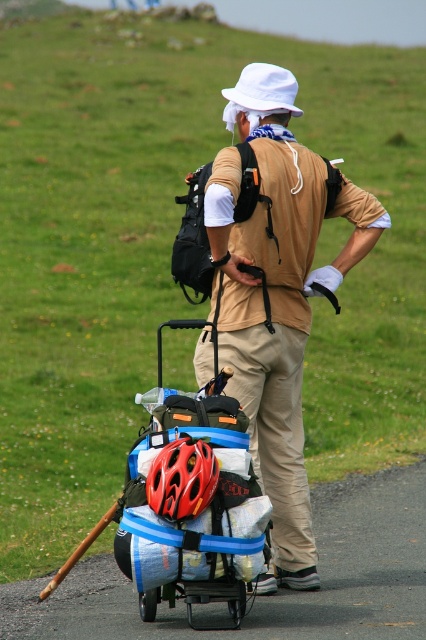
Who is positioned more to the left, matte black wagon at center or shiny red helmet at center?

shiny red helmet at center

Does matte black wagon at center appear on the right side of shiny red helmet at center?

Indeed, matte black wagon at center is positioned on the right side of shiny red helmet at center.

Does point (238, 589) come in front of point (164, 486)?

No.

You are a GUI agent. You are given a task and a screenshot of the screen. Output one action in this format:
    pyautogui.click(x=<x>, y=<y>)
    Task: Click on the matte black wagon at center
    This screenshot has width=426, height=640.
    Given the screenshot: What is the action you would take?
    pyautogui.click(x=192, y=500)

Consider the image. Does matte black wagon at center have a larger size compared to khaki pants at center?

Indeed, matte black wagon at center has a larger size compared to khaki pants at center.

Can you confirm if matte black wagon at center is positioned to the left of khaki pants at center?

Indeed, matte black wagon at center is positioned on the left side of khaki pants at center.

Is point (233, 476) closer to camera compared to point (270, 390)?

Yes, it is in front of point (270, 390).

Locate an element on the screen. The width and height of the screenshot is (426, 640). matte black wagon at center is located at coordinates (192, 500).

Looking at this image, is tan fabric backpack at center below matte black wagon at center?

No, tan fabric backpack at center is not below matte black wagon at center.

Does point (290, 548) come closer to viewer compared to point (155, 387)?

Yes, it is.

Is point (213, 240) positioned behind point (149, 552)?

Yes.

You are a GUI agent. You are given a task and a screenshot of the screen. Output one action in this format:
    pyautogui.click(x=<x>, y=<y>)
    Task: Click on the tan fabric backpack at center
    This screenshot has width=426, height=640.
    Given the screenshot: What is the action you would take?
    pyautogui.click(x=276, y=296)